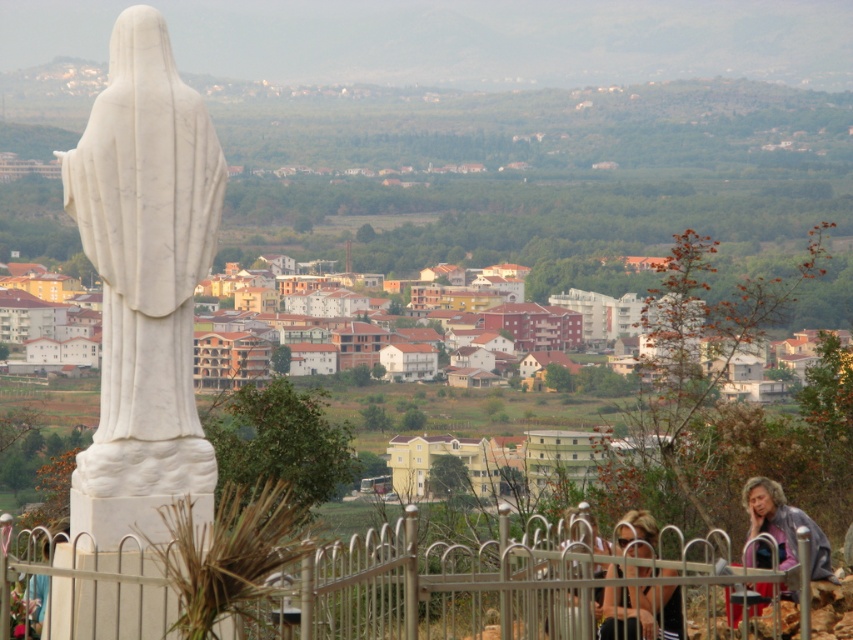
You are standing in the scenic town valley and want to take a photo of the statue of the figure in the foreground. However, there is a black fabric dress at lower right in your shot. Can you move to the left to avoid it?

The black fabric dress at lower right is located at point (640, 612), so moving to the left might help avoid it since the dress is positioned towards the right side of the frame.

You are a photographer planning to take a picture of the white marble statue at left and the gray fabric jacket at lower right. Based on their sizes, which object should you focus on first if you want to ensure both are in frame without zooming in or out?

The white marble statue at left might be wider than gray fabric jacket at lower right, so focusing on the statue first would help ensure both fit in the frame since it occupies more space.

You are a photographer standing in the scenic town valley view. You see two items of clothing at the lower right corner of your viewfinder, a black fabric dress at lower right and a gray fabric jacket at lower right. Which clothing item appears smaller in your current view?

The black fabric dress at lower right appears smaller compared to the gray fabric jacket at lower right in the viewfinder.